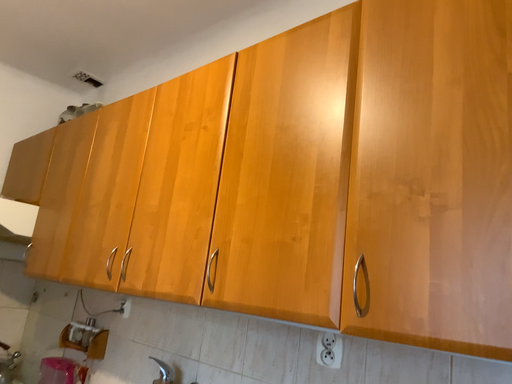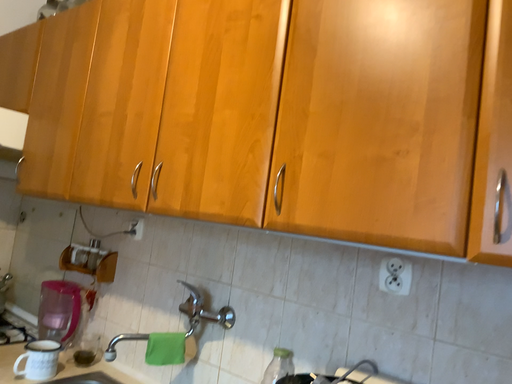
Question: How did the camera likely rotate when shooting the video?

Choices:
 (A) rotated downward
 (B) rotated upward

Answer: (A)